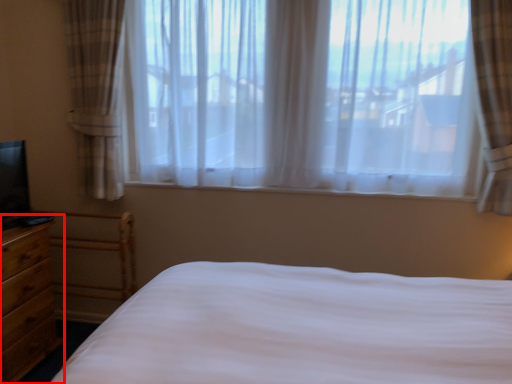
Question: Considering the relative positions of nightstand (annotated by the red box) and window in the image provided, where is nightstand (annotated by the red box) located with respect to the staircase?

Choices:
 (A) left
 (B) right

Answer: (A)